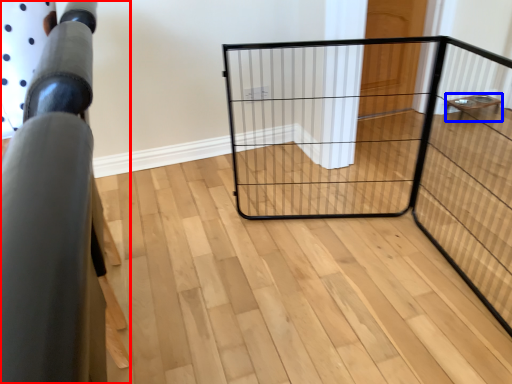
Question: Which of the following is the farthest to the observer, furniture (highlighted by a red box) or furniture (highlighted by a blue box)?

Choices:
 (A) furniture
 (B) furniture

Answer: (B)